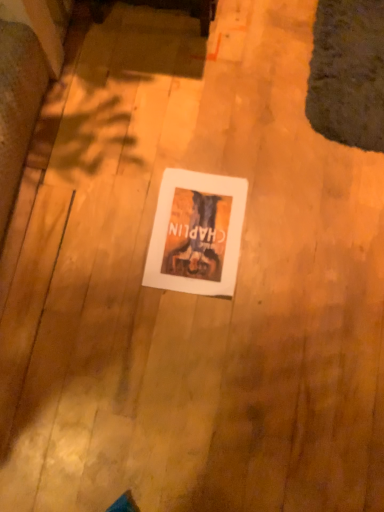
Identify the location of free point in front of white paper poster at center. The width and height of the screenshot is (384, 512). (197, 339).